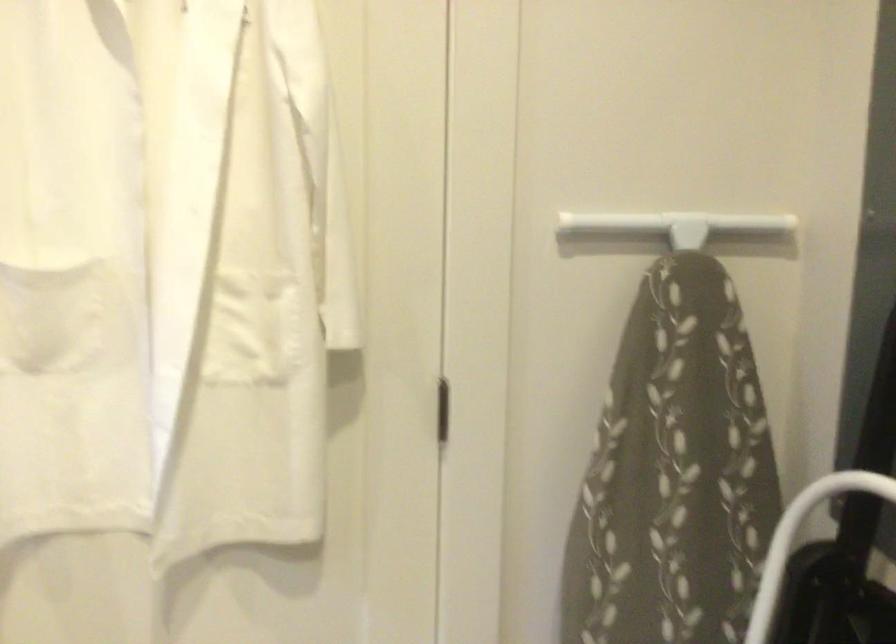
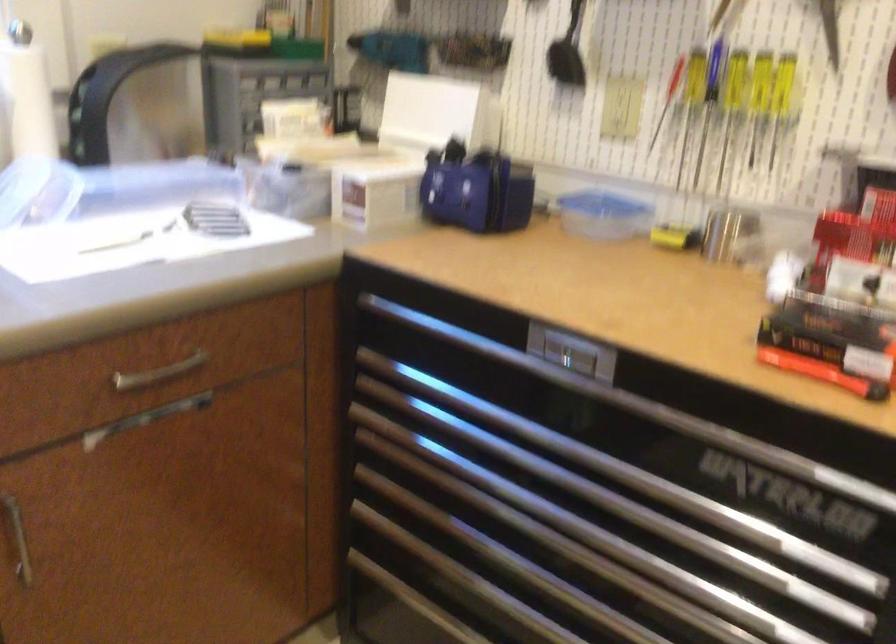
The images are taken continuously from a first-person perspective. In which direction is your viewpoint rotating?

The camera's rotation is toward left-down.